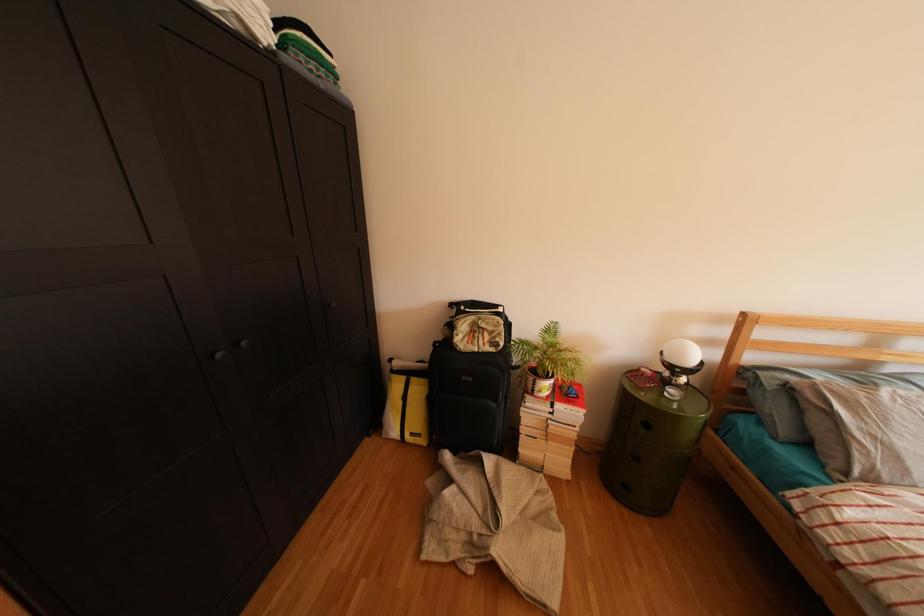
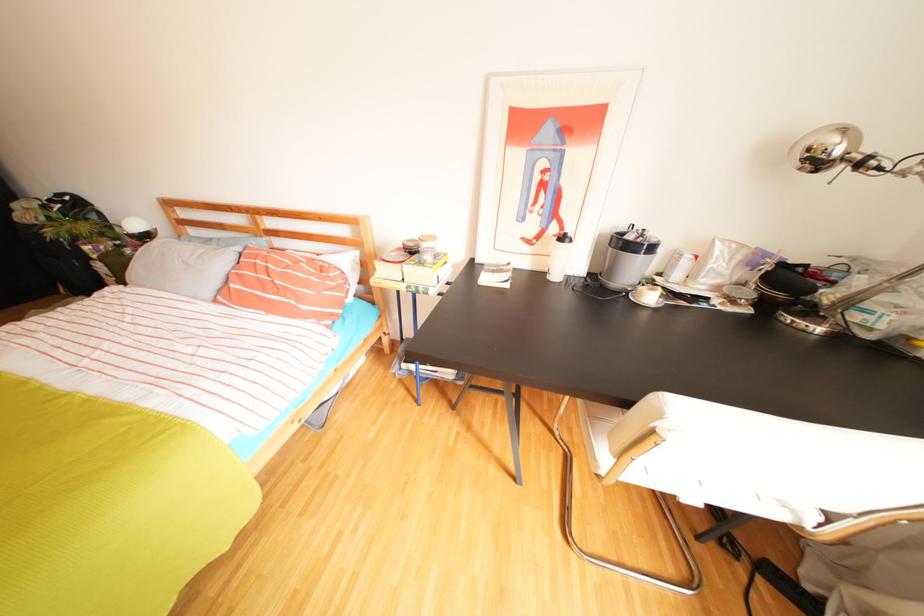
Question: What movement of the cameraman would produce the second image?

Choices:
 (A) Left
 (B) Right
 (C) Forward
 (D) Backward

Answer: (B)